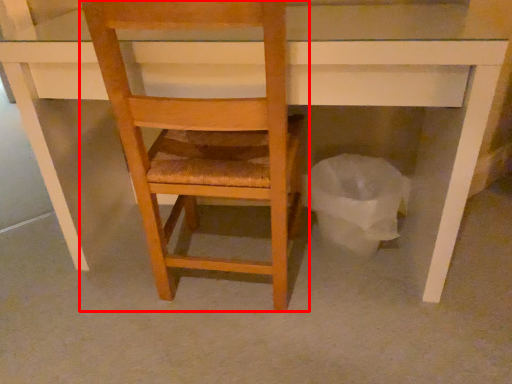
Question: Where is chair (annotated by the red box) located in relation to garbage in the image?

Choices:
 (A) left
 (B) right

Answer: (A)